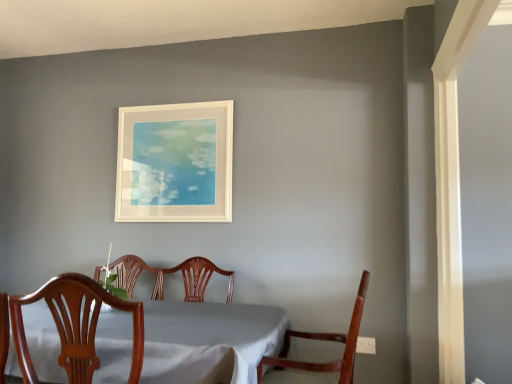
What do you see at coordinates (75, 326) in the screenshot?
I see `wooden chair at center, marked as the second chair in a right-to-left arrangement` at bounding box center [75, 326].

The width and height of the screenshot is (512, 384). What do you see at coordinates (175, 163) in the screenshot? I see `white matte picture frame at upper center` at bounding box center [175, 163].

Image resolution: width=512 pixels, height=384 pixels. Find the location of `white cloth-covered table at center`. white cloth-covered table at center is located at coordinates 208,341.

Does point (24, 299) come farther from viewer compared to point (220, 106)?

No, (24, 299) is in front of (220, 106).

Is wooden chair at center, marked as the second chair in a right-to-left arrangement, looking in the opposite direction of white matte picture frame at upper center?

That's not correct — wooden chair at center, marked as the second chair in a right-to-left arrangement, is not looking away from white matte picture frame at upper center.

I want to click on the 1st chair below the white matte picture frame at upper center (from the image's perspective), so click(75, 326).

In the scene shown: Is wooden chair at center, which appears as the first chair when viewed from the left, next to white matte picture frame at upper center and touching it?

No, wooden chair at center, which appears as the first chair when viewed from the left, is not in contact with white matte picture frame at upper center.

Does mahogany wood chair at lower right, which is the first chair in right-to-left order, contain white cloth-covered table at center?

No, white cloth-covered table at center is not surrounded by mahogany wood chair at lower right, which is the first chair in right-to-left order.

Consider the image. Between mahogany wood chair at lower right, which is the first chair in right-to-left order, and white cloth-covered table at center, which one has less height?

With less height is white cloth-covered table at center.

Is mahogany wood chair at lower right, the 2th chair viewed from the left, with white cloth-covered table at center?

No.

What are the coordinates of `table located underneath the mahogany wood chair at lower right, the 2th chair viewed from the left (from a real-world perspective)` in the screenshot? It's located at (208, 341).

Between point (64, 357) and point (342, 342), which one is positioned behind?

Positioned behind is point (342, 342).

Is wooden chair at center, marked as the second chair in a right-to-left arrangement, next to mahogany wood chair at lower right, the 2th chair viewed from the left?

No, wooden chair at center, marked as the second chair in a right-to-left arrangement, is not beside mahogany wood chair at lower right, the 2th chair viewed from the left.

Would you say wooden chair at center, marked as the second chair in a right-to-left arrangement, is outside mahogany wood chair at lower right, which is the first chair in right-to-left order?

Yes, wooden chair at center, marked as the second chair in a right-to-left arrangement, is not within mahogany wood chair at lower right, which is the first chair in right-to-left order.

Image resolution: width=512 pixels, height=384 pixels. I want to click on chair behind the white cloth-covered table at center, so coord(318,363).

Which object is positioned more to the left, white cloth-covered table at center or mahogany wood chair at lower right, which is the first chair in right-to-left order?

white cloth-covered table at center.

Which of these two, white cloth-covered table at center or mahogany wood chair at lower right, the 2th chair viewed from the left, is thinner?

Thinner between the two is mahogany wood chair at lower right, the 2th chair viewed from the left.

How much distance is there between mahogany wood chair at lower right, which is the first chair in right-to-left order, and white matte picture frame at upper center?

mahogany wood chair at lower right, which is the first chair in right-to-left order, is 4.07 feet away from white matte picture frame at upper center.

Does mahogany wood chair at lower right, the 2th chair viewed from the left, appear on the right side of white matte picture frame at upper center?

Yes.

How many degrees apart are the facing directions of mahogany wood chair at lower right, the 2th chair viewed from the left, and white matte picture frame at upper center?

The facing directions of mahogany wood chair at lower right, the 2th chair viewed from the left, and white matte picture frame at upper center are 91.2 degrees apart.

Consider the image. Which is closer to the camera, (x=302, y=363) or (x=119, y=124)?

Point (x=302, y=363) appears to be closer to the viewer than point (x=119, y=124).

You are a GUI agent. You are given a task and a screenshot of the screen. Output one action in this format:
    pyautogui.click(x=<x>, y=<y>)
    Task: Click on the picture frame above the wooden chair at center, marked as the second chair in a right-to-left arrangement (from the image's perspective)
    
    Given the screenshot: What is the action you would take?
    pyautogui.click(x=175, y=163)

Considering the positions of objects white matte picture frame at upper center and wooden chair at center, which appears as the first chair when viewed from the left, in the image provided, who is more to the right, white matte picture frame at upper center or wooden chair at center, which appears as the first chair when viewed from the left,?

wooden chair at center, which appears as the first chair when viewed from the left.

From a real-world perspective, is white matte picture frame at upper center located beneath wooden chair at center, marked as the second chair in a right-to-left arrangement?

No.

Is white matte picture frame at upper center facing away from wooden chair at center, which appears as the first chair when viewed from the left?

No, white matte picture frame at upper center is not facing away from wooden chair at center, which appears as the first chair when viewed from the left.

Could wooden chair at center, marked as the second chair in a right-to-left arrangement, be considered to be inside white cloth-covered table at center?

Yes, wooden chair at center, marked as the second chair in a right-to-left arrangement, can be found within white cloth-covered table at center.

Looking at this image, between white cloth-covered table at center and wooden chair at center, marked as the second chair in a right-to-left arrangement, which one has more height?

white cloth-covered table at center.

How far apart are white cloth-covered table at center and wooden chair at center, which appears as the first chair when viewed from the left?

9.49 inches.

From a real-world perspective, between white cloth-covered table at center and wooden chair at center, marked as the second chair in a right-to-left arrangement, who is vertically higher?

wooden chair at center, marked as the second chair in a right-to-left arrangement, is physically above.

From the image's perspective, starting from the white matte picture frame at upper center, which chair is the 1st one below? Please provide its 2D coordinates.

[(75, 326)]

You are a GUI agent. You are given a task and a screenshot of the screen. Output one action in this format:
    pyautogui.click(x=<x>, y=<y>)
    Task: Click on the chair behind the white cloth-covered table at center
    The width and height of the screenshot is (512, 384).
    Given the screenshot: What is the action you would take?
    pyautogui.click(x=318, y=363)

Considering their positions, is white cloth-covered table at center positioned further to white matte picture frame at upper center than mahogany wood chair at lower right, the 2th chair viewed from the left?

mahogany wood chair at lower right, the 2th chair viewed from the left, is further to white matte picture frame at upper center.

From the image, which object appears to be farther from white cloth-covered table at center, wooden chair at center, which appears as the first chair when viewed from the left, or mahogany wood chair at lower right, which is the first chair in right-to-left order?

Among the two, mahogany wood chair at lower right, which is the first chair in right-to-left order, is located further to white cloth-covered table at center.

Based on the photo, from the image, which object appears to be nearer to white matte picture frame at upper center, white cloth-covered table at center or wooden chair at center, which appears as the first chair when viewed from the left?

white cloth-covered table at center is closer to white matte picture frame at upper center.

Looking at the image, which one is located further to mahogany wood chair at lower right, the 2th chair viewed from the left, wooden chair at center, which appears as the first chair when viewed from the left, or white cloth-covered table at center?

Based on the image, wooden chair at center, which appears as the first chair when viewed from the left, appears to be further to mahogany wood chair at lower right, the 2th chair viewed from the left.

Consider the image. Considering their positions, is mahogany wood chair at lower right, the 2th chair viewed from the left, positioned further to wooden chair at center, marked as the second chair in a right-to-left arrangement, than white matte picture frame at upper center?

Based on the image, white matte picture frame at upper center appears to be further to wooden chair at center, marked as the second chair in a right-to-left arrangement.

Considering their positions, is white matte picture frame at upper center positioned closer to white cloth-covered table at center than wooden chair at center, which appears as the first chair when viewed from the left?

wooden chair at center, which appears as the first chair when viewed from the left, is closer to white cloth-covered table at center.

From the picture: When comparing their distances from wooden chair at center, which appears as the first chair when viewed from the left, does mahogany wood chair at lower right, which is the first chair in right-to-left order, or white cloth-covered table at center seem further?

mahogany wood chair at lower right, which is the first chair in right-to-left order, is further to wooden chair at center, which appears as the first chair when viewed from the left.

Estimate the real-world distances between objects in this image. Which object is closer to mahogany wood chair at lower right, the 2th chair viewed from the left, wooden chair at center, which appears as the first chair when viewed from the left, or white matte picture frame at upper center?

wooden chair at center, which appears as the first chair when viewed from the left, lies closer to mahogany wood chair at lower right, the 2th chair viewed from the left, than the other object.

At what (x,y) coordinates should I click in order to perform the action: click on chair situated between white cloth-covered table at center and mahogany wood chair at lower right, the 2th chair viewed from the left, from left to right. Please return your answer as a coordinate pair (x, y). Looking at the image, I should click on (75, 326).

Locate an element on the screen. chair positioned between wooden chair at center, marked as the second chair in a right-to-left arrangement, and white matte picture frame at upper center from near to far is located at coordinates (318, 363).

Where is `table positioned between wooden chair at center, marked as the second chair in a right-to-left arrangement, and white matte picture frame at upper center from near to far`? Image resolution: width=512 pixels, height=384 pixels. table positioned between wooden chair at center, marked as the second chair in a right-to-left arrangement, and white matte picture frame at upper center from near to far is located at coordinates (208, 341).

Find the location of a particular element. This screenshot has width=512, height=384. chair positioned between white cloth-covered table at center and white matte picture frame at upper center from near to far is located at coordinates click(318, 363).